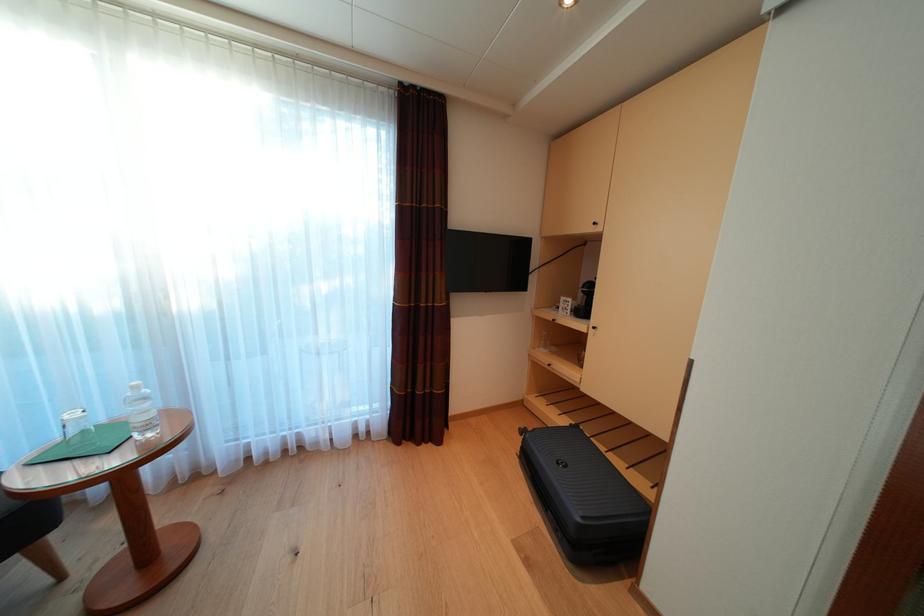
Locate an element on the screen. suitcase handle is located at coordinates (618, 549).